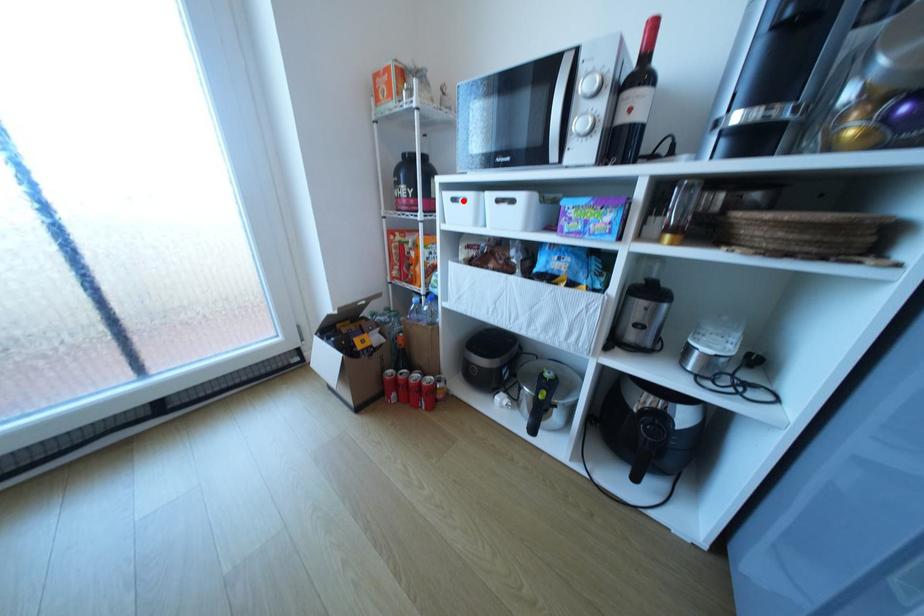
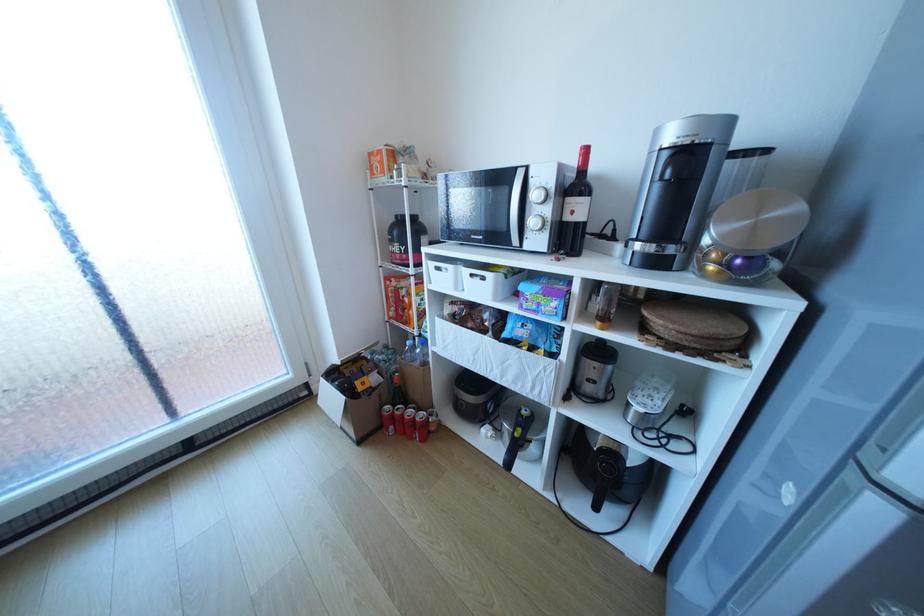
The point at the highlighted location is marked in the first image. Where is the corresponding point in the second image?

(446, 268)